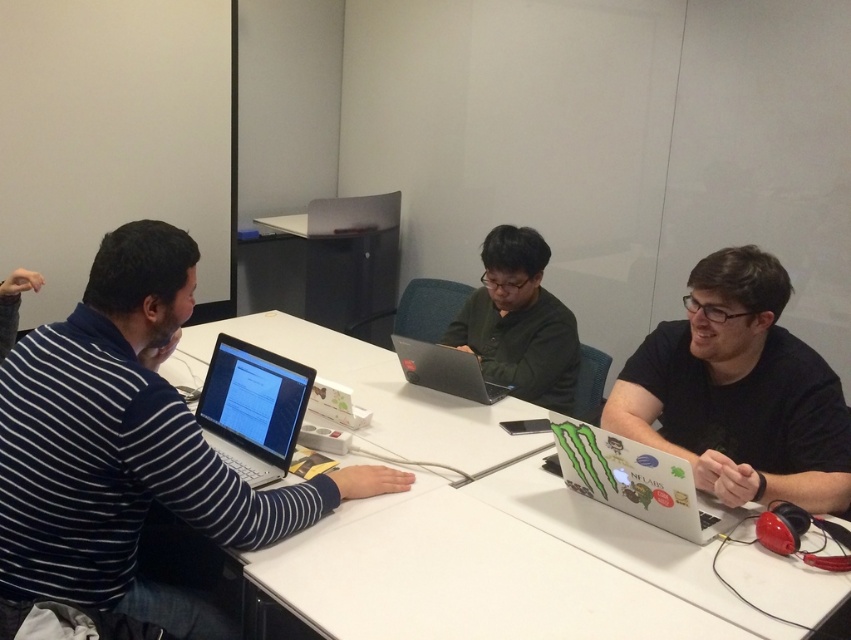
Question: Can you confirm if white glossy laptop at right is thinner than glossy black laptop at center?

Choices:
 (A) no
 (B) yes

Answer: (A)

Question: In this image, where is matte black shirt at right located relative to silver metallic laptop at left?

Choices:
 (A) left
 (B) right

Answer: (B)

Question: Does green matte jacket at center come in front of glossy black laptop at center?

Choices:
 (A) yes
 (B) no

Answer: (B)

Question: Which of the following is the farthest from the observer?

Choices:
 (A) white glossy laptop at right
 (B) white glossy table at center
 (C) matte black shirt at right
 (D) glossy black laptop at center

Answer: (D)

Question: Which point appears closest to the camera in this image?

Choices:
 (A) (207, 412)
 (B) (658, 384)

Answer: (A)

Question: Which point is closer to the camera?

Choices:
 (A) (256, 456)
 (B) (667, 483)
 (C) (415, 342)

Answer: (B)